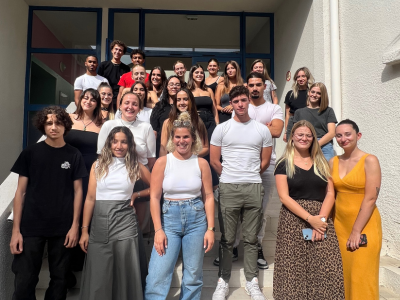
Where is `glass windows`? Image resolution: width=400 pixels, height=300 pixels. glass windows is located at coordinates (30, 130), (45, 69), (55, 36), (127, 30), (180, 30), (256, 27), (266, 62), (159, 59), (206, 64).